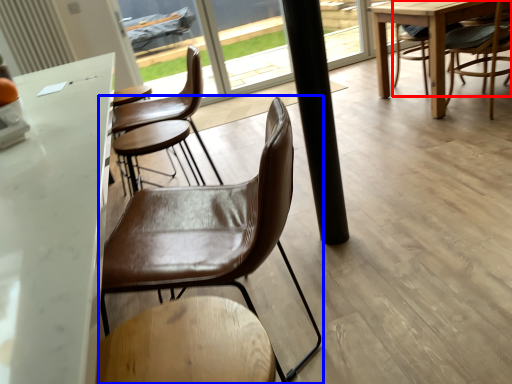
Question: Among these objects, which one is nearest to the camera, chair (highlighted by a red box) or chair (highlighted by a blue box)?

Choices:
 (A) chair
 (B) chair

Answer: (B)